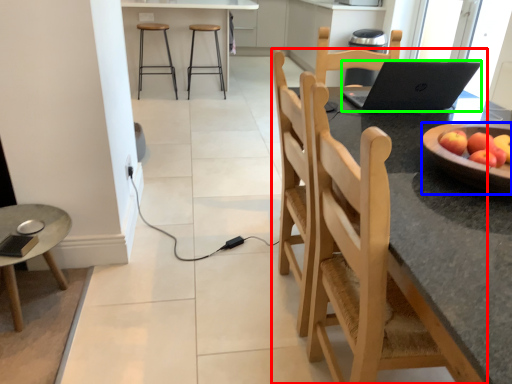
Question: Which object is the closest to the chair (highlighted by a red box)? Choose among these: bowl (highlighted by a blue box) or laptop (highlighted by a green box).

Choices:
 (A) bowl
 (B) laptop

Answer: (A)